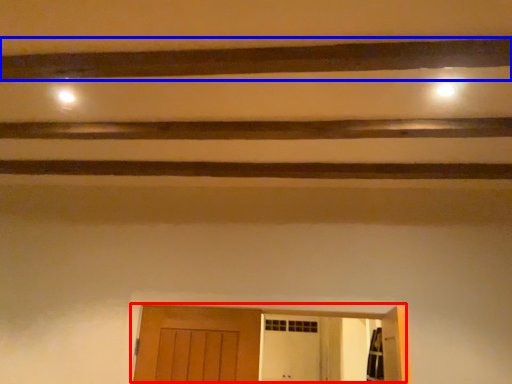
Question: Among these objects, which one is nearest to the camera, door (highlighted by a red box) or plank (highlighted by a blue box)?

Choices:
 (A) door
 (B) plank

Answer: (B)